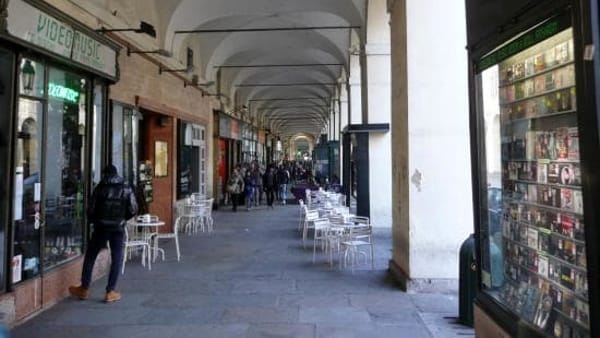
At what (x,y) coordinates should I click in order to perform the action: click on chair. Please return your answer as a coordinate pair (x, y). The image size is (600, 338). Looking at the image, I should click on (137, 241), (171, 235), (324, 229), (309, 221), (345, 211), (302, 209), (194, 208), (212, 204).